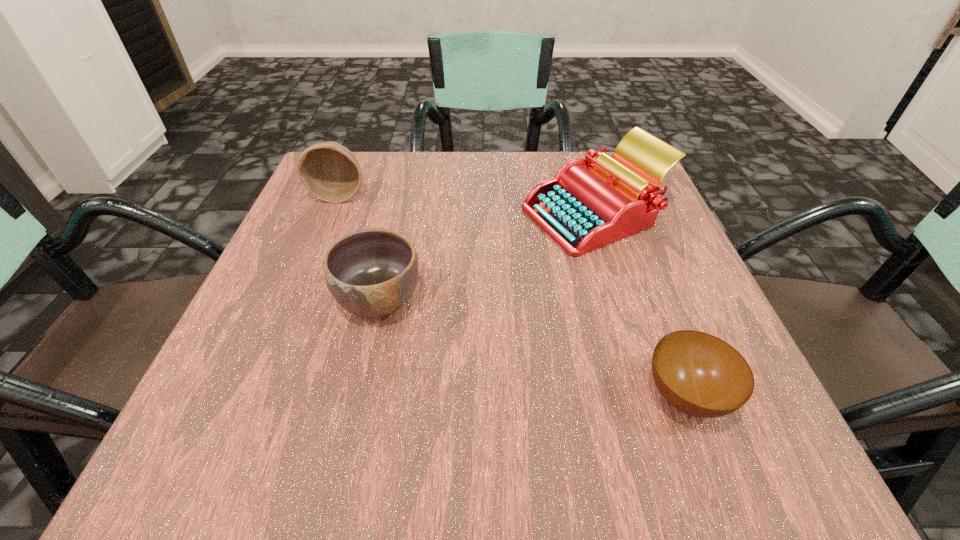
Image resolution: width=960 pixels, height=540 pixels. Find the location of `vacant space located 0.350m on the typing side of the typewriter`. vacant space located 0.350m on the typing side of the typewriter is located at coordinates (352, 215).

Where is `vacant position located on the right of the second bowl from right to left`? The width and height of the screenshot is (960, 540). vacant position located on the right of the second bowl from right to left is located at coordinates (554, 300).

At what (x,y) coordinates should I click in order to perform the action: click on free space located 0.060m on the left of the nearest object. Please return your answer as a coordinate pair (x, y). The height and width of the screenshot is (540, 960). Looking at the image, I should click on (599, 396).

I want to click on bowl situated at the far edge, so click(330, 172).

The height and width of the screenshot is (540, 960). Find the location of `typewriter located at the far edge`. typewriter located at the far edge is located at coordinates (589, 203).

Where is `object located in the near edge section of the desktop`? Image resolution: width=960 pixels, height=540 pixels. object located in the near edge section of the desktop is located at coordinates (699, 374).

Find the location of a particular element. The width and height of the screenshot is (960, 540). typewriter situated at the right edge is located at coordinates (589, 203).

Where is `bowl present at the right edge`? bowl present at the right edge is located at coordinates (699, 374).

Where is `object that is at the far left corner`? The height and width of the screenshot is (540, 960). object that is at the far left corner is located at coordinates (330, 172).

Image resolution: width=960 pixels, height=540 pixels. What are the coordinates of `object that is at the far right corner` in the screenshot? It's located at (589, 203).